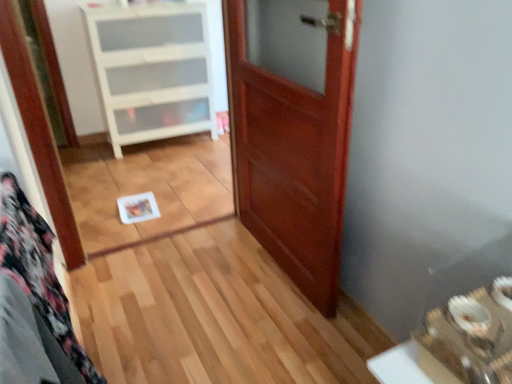
I want to click on vacant space underneath mahogany wood door at center (from a real-world perspective), so click(276, 266).